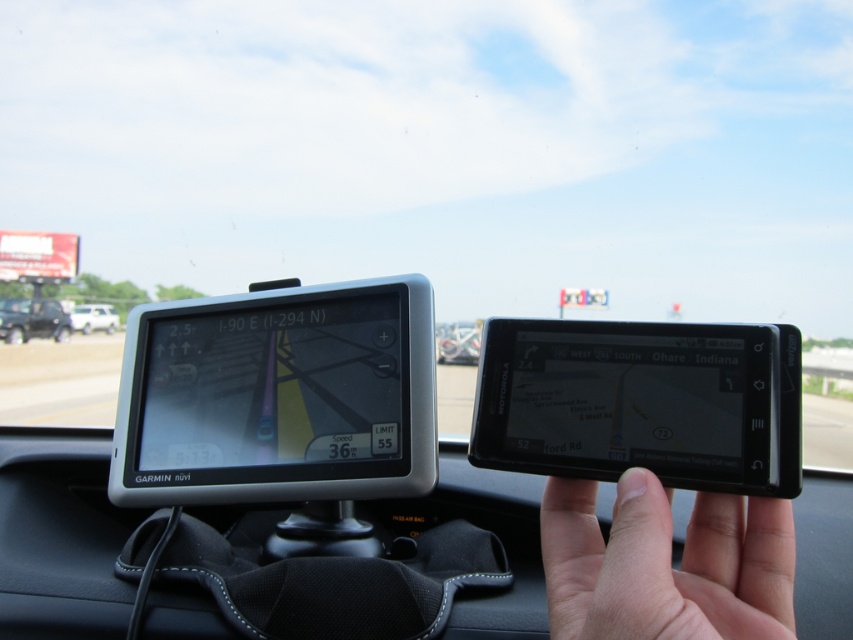
Question: Based on their relative distances, which object is nearer to the matte black suv at left?

Choices:
 (A) white matte car at left
 (B) metallic silver car at center

Answer: (A)

Question: Which object appears farthest from the camera in this image?

Choices:
 (A) black glossy tablet at center
 (B) metallic silver car at center
 (C) matte black suv at left

Answer: (C)

Question: Which point appears closest to the camera in this image?

Choices:
 (A) (125, 486)
 (B) (73, 308)
 (C) (456, 352)

Answer: (A)

Question: Does black glossy gps device at center have a lesser width compared to skinny white hand at center?

Choices:
 (A) no
 (B) yes

Answer: (A)

Question: Considering the relative positions of skinny white hand at center and matte black suv at left in the image provided, where is skinny white hand at center located with respect to matte black suv at left?

Choices:
 (A) right
 (B) left

Answer: (A)

Question: Is black plastic dashboard at center positioned in front of metallic silver car at center?

Choices:
 (A) yes
 (B) no

Answer: (A)